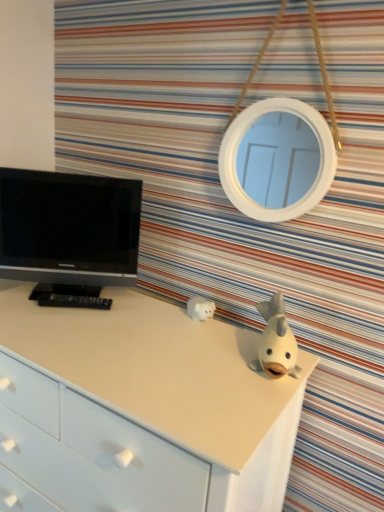
Find the location of a particular element. The width and height of the screenshot is (384, 512). free space in front of black glossy tv at left is located at coordinates [67, 330].